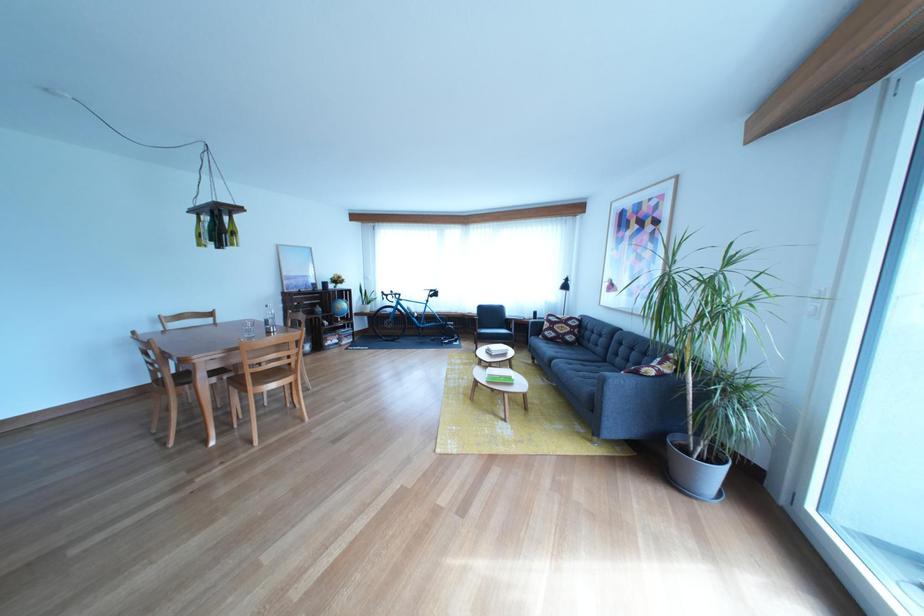
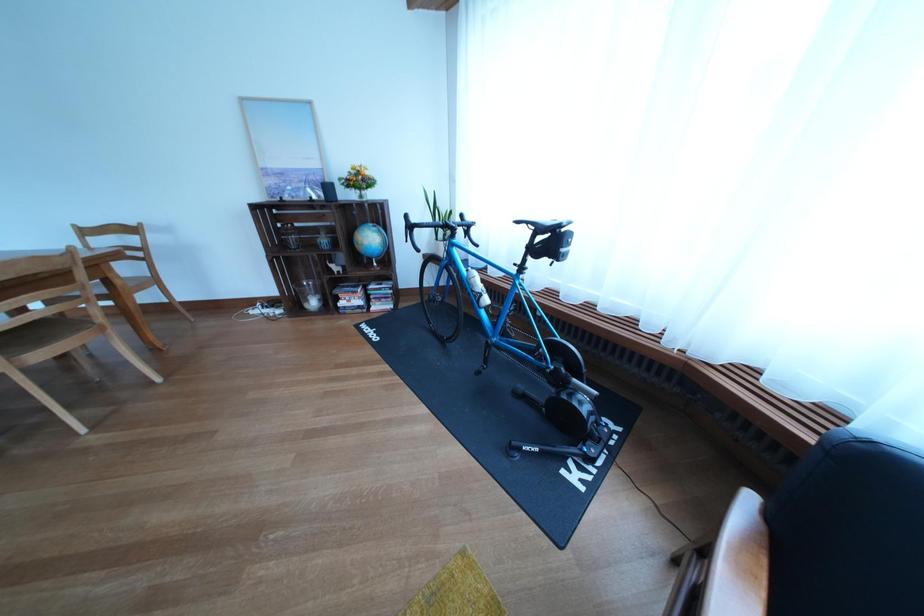
In the second image, find the point that corresponds to point 447,300 in the first image.

(563, 248)